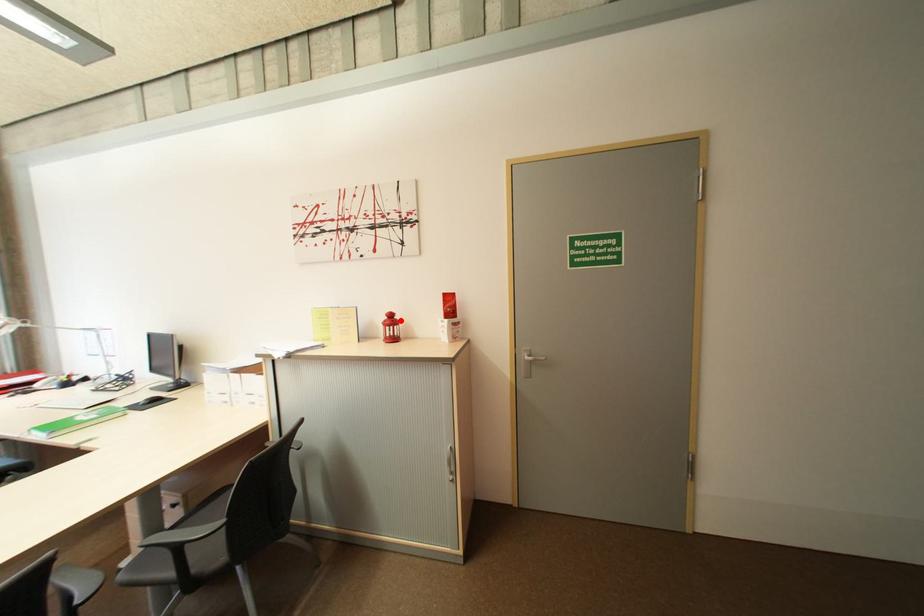
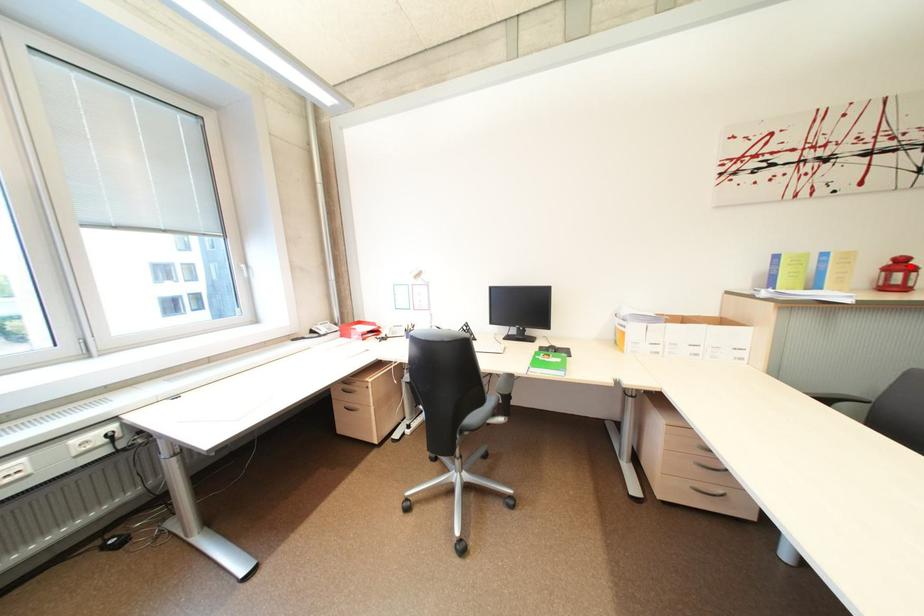
I am providing you with two images of the same scene from different viewpoints. A red point is marked on the first image and another point is marked on the second image. Does the point marked in image1 correspond to the same location as the one in image2?

Yes